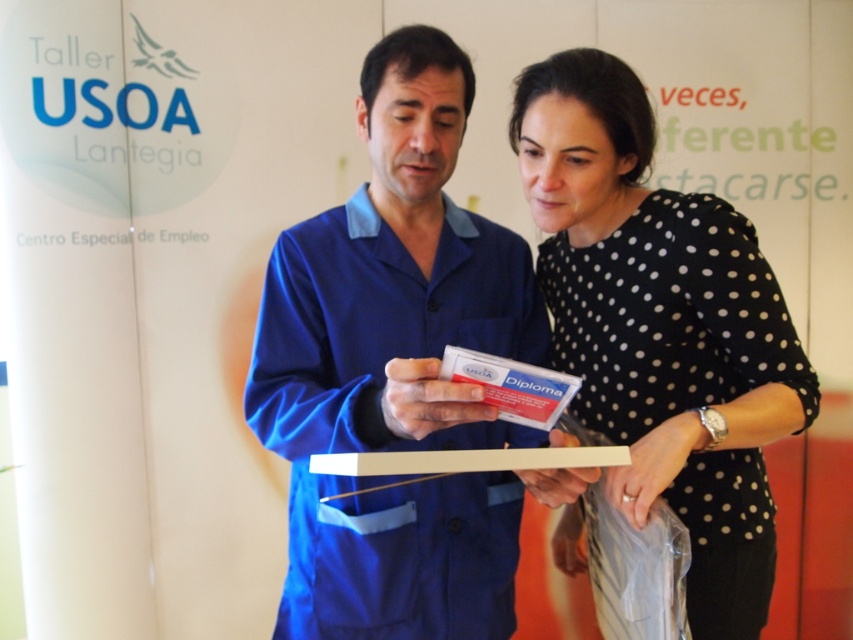
You are an event photographer who needs to capture a closeup shot of both the blue fabric shirt at center and the black dotted shirt at center. The camera you are using has a focus range of 8 inches. Can you fit both shirts into the camera focus range without moving the camera?

The blue fabric shirt at center and black dotted shirt at center are 9.62 inches apart, which is wider than the camera focus range of 8 inches. Therefore, you cannot fit both shirts into the camera focus range without moving the camera.

You are an event photographer at the Taller USOA Lantegia ceremony. You need to ensure that the blue fabric shirt at center and the black dotted shirt at center are both visible in your photo. Given their heights, which shirt should you focus on to capture both shirts fully in the frame?

The blue fabric shirt at center is taller than the black dotted shirt at center. To capture both shirts fully, focus on the blue fabric shirt at center as it is taller, ensuring the frame accommodates its height, which would naturally include the shorter black dotted shirt at center.